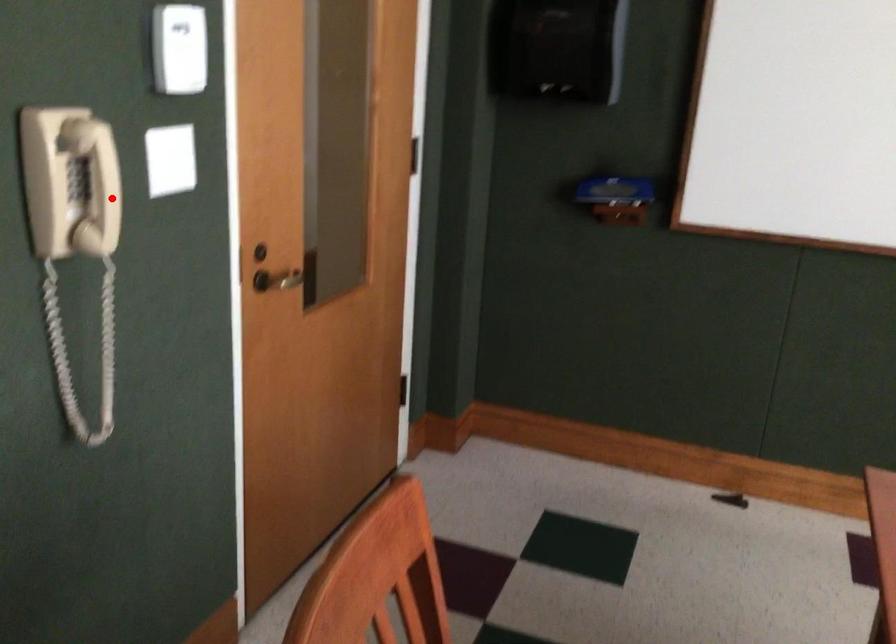
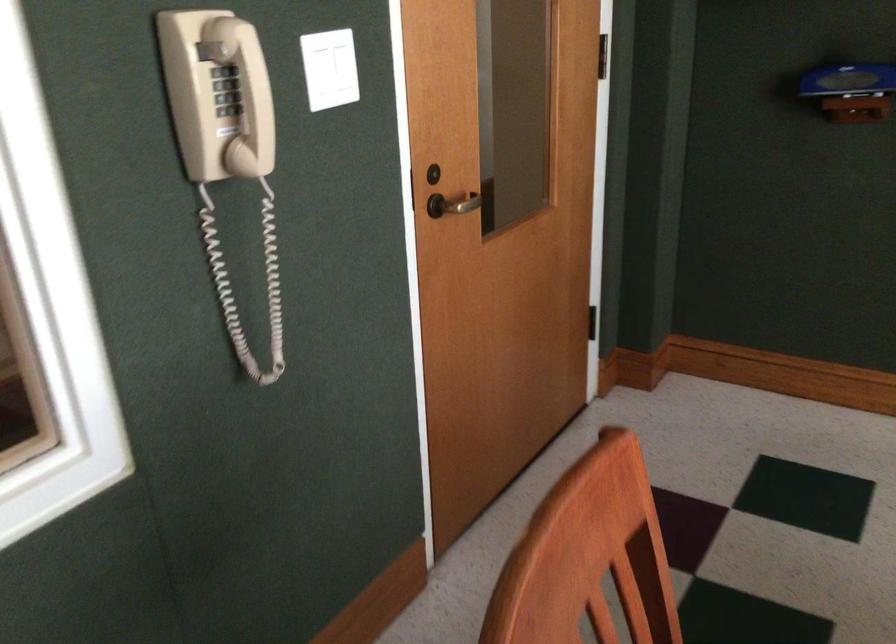
Question: I am providing you with two images of the same scene from different viewpoints. Image1 has a red point marked. In image2, the corresponding 3D location appears at what relative position? Reply with the corresponding letter.

Choices:
 (A) Closer
 (B) Farther

Answer: (A)